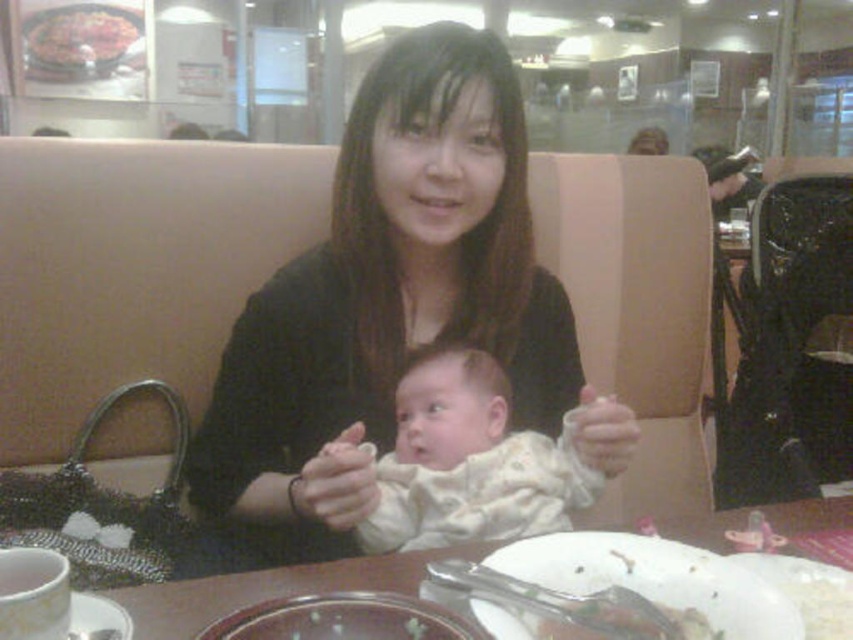
Question: In this image, where is white soft baby at center located relative to white matte plate at lower center?

Choices:
 (A) above
 (B) below

Answer: (A)

Question: Which point is farther to the camera?

Choices:
 (A) transparent glass plate at center
 (B) white matte plate at lower center
 (C) white soft baby at center
 (D) wooden table at center

Answer: (C)

Question: Which object appears farthest from the camera in this image?

Choices:
 (A) white matte plate at lower center
 (B) black matte shirt at center
 (C) shiny metallic plate at upper left

Answer: (C)

Question: Estimate the real-world distances between objects in this image. Which object is farther from the black matte shirt at center?

Choices:
 (A) wooden table at center
 (B) transparent glass plate at center
 (C) shiny metallic plate at upper left

Answer: (C)

Question: Considering the relative positions of white matte plate at lower center and wooden table at center in the image provided, where is white matte plate at lower center located with respect to wooden table at center?

Choices:
 (A) right
 (B) left

Answer: (A)

Question: Does white soft baby at center appear on the right side of white matte plate at lower center?

Choices:
 (A) no
 (B) yes

Answer: (A)